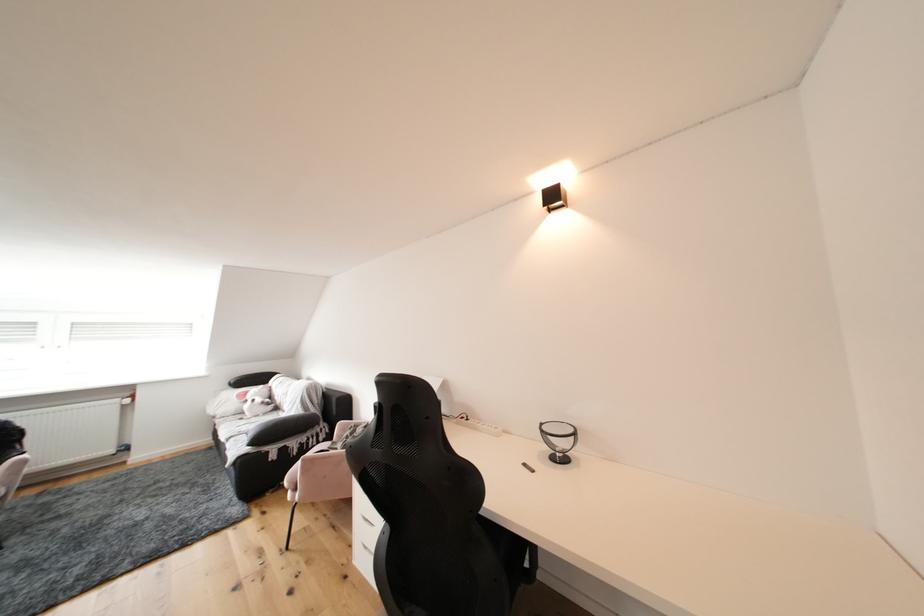
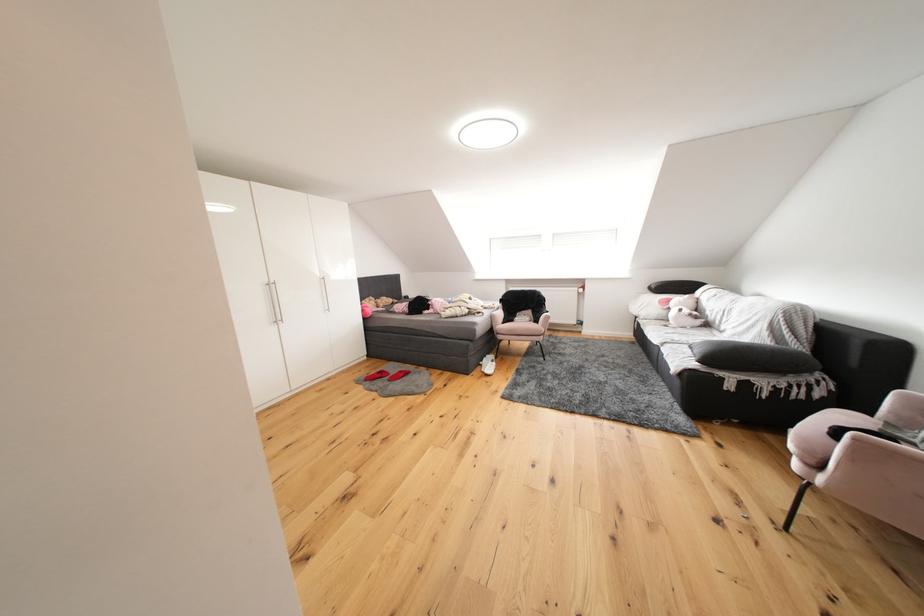
Where in the second image is the point corresponding to (349,429) from the first image?

(916, 400)